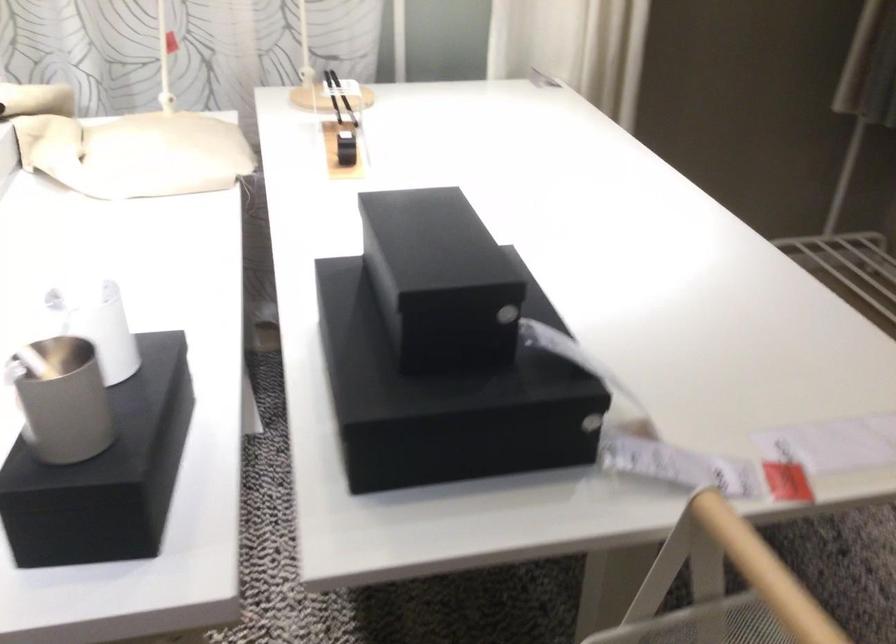
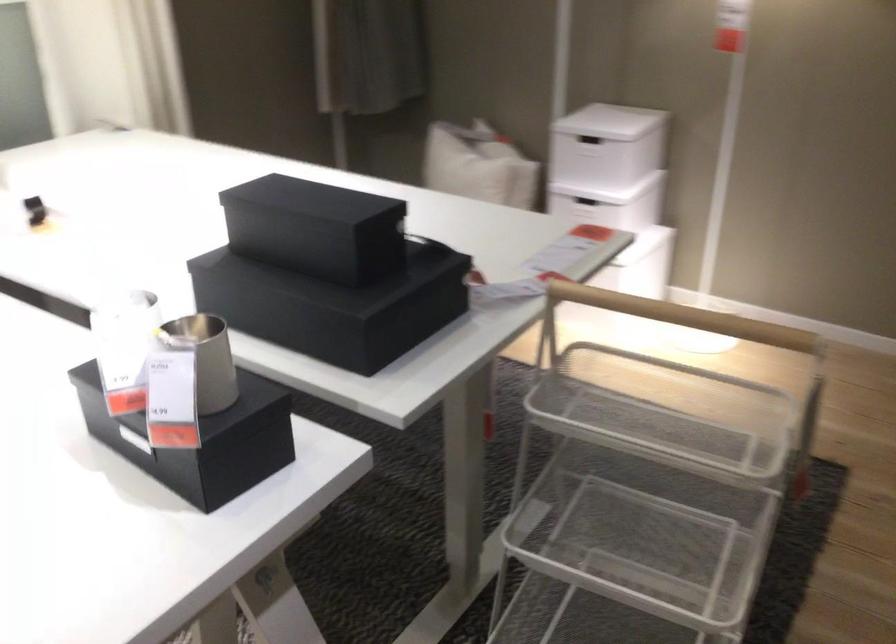
The point at [402,336] is marked in the first image. Where is the corresponding point in the second image?

(328, 272)